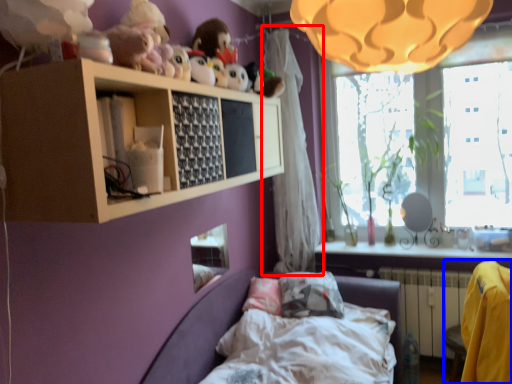
Question: Which object appears farthest to the camera in this image, curtain (highlighted by a red box) or armchair (highlighted by a blue box)?

Choices:
 (A) curtain
 (B) armchair

Answer: (A)